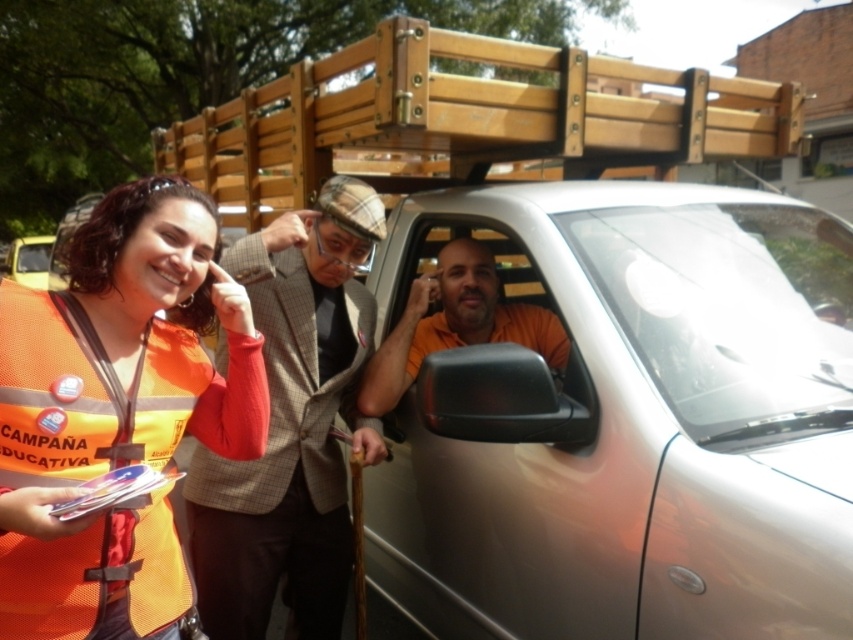
You are planning to park your car next to the silver metallic car at center and the plaid fabric suit at center. Based on their widths, which one requires more space for parking?

The silver metallic car at center requires more space for parking because its width surpasses that of the plaid fabric suit at center.